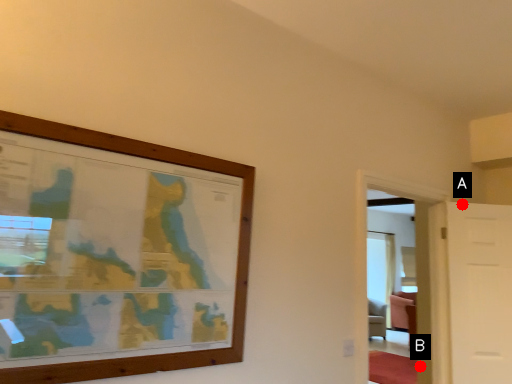
Question: Two points are circled on the image, labeled by A and B beside each circle. Which of the following is the closest to the observer?

Choices:
 (A) A is closer
 (B) B is closer

Answer: (A)